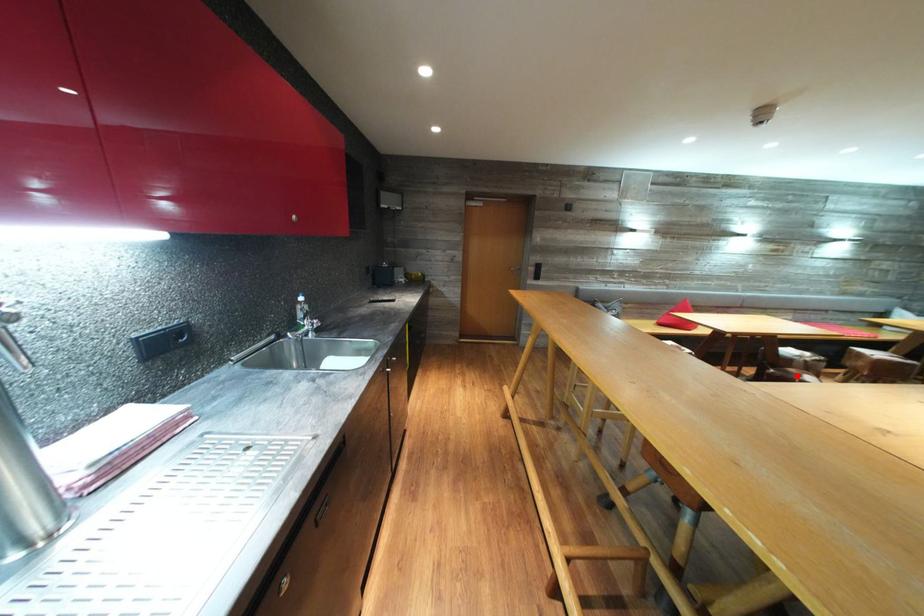
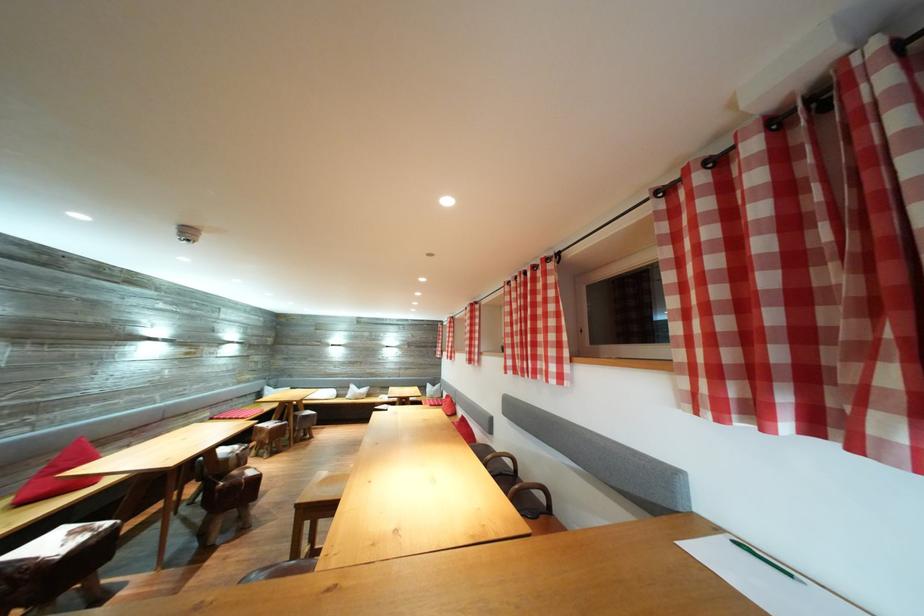
Question: I am providing you with two images of the same scene from different viewpoints. In image1, a red point is highlighted. Considering the same 3D point in image2, which of the following is correct?

Choices:
 (A) It is closer
 (B) It is farther

Answer: (B)